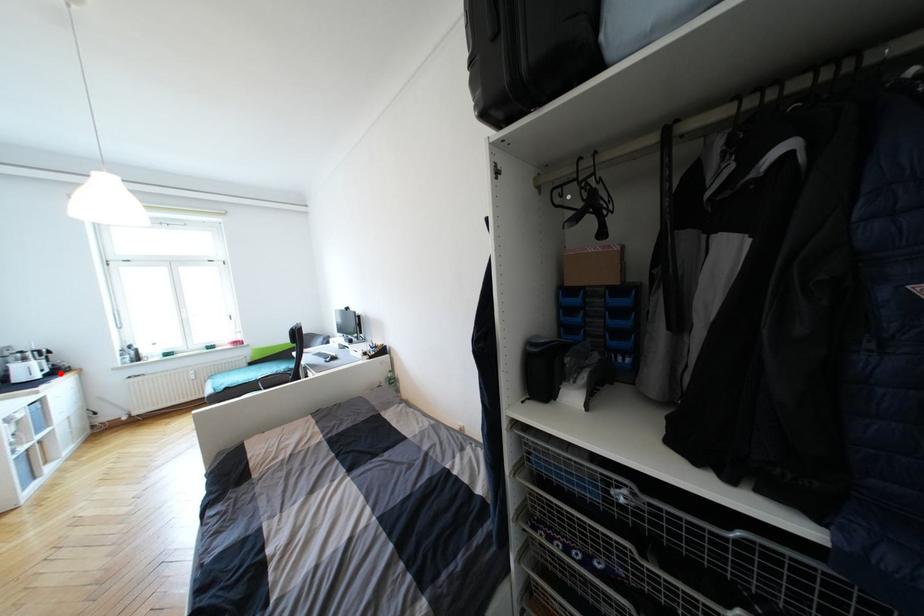
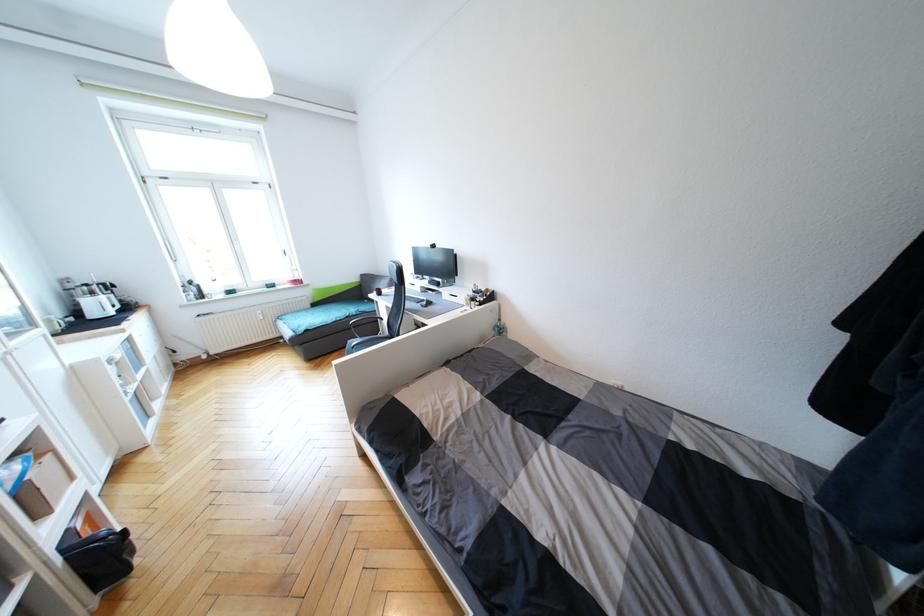
Where in the second image is the point corresponding to the highlighted location from the first image?

(130, 309)